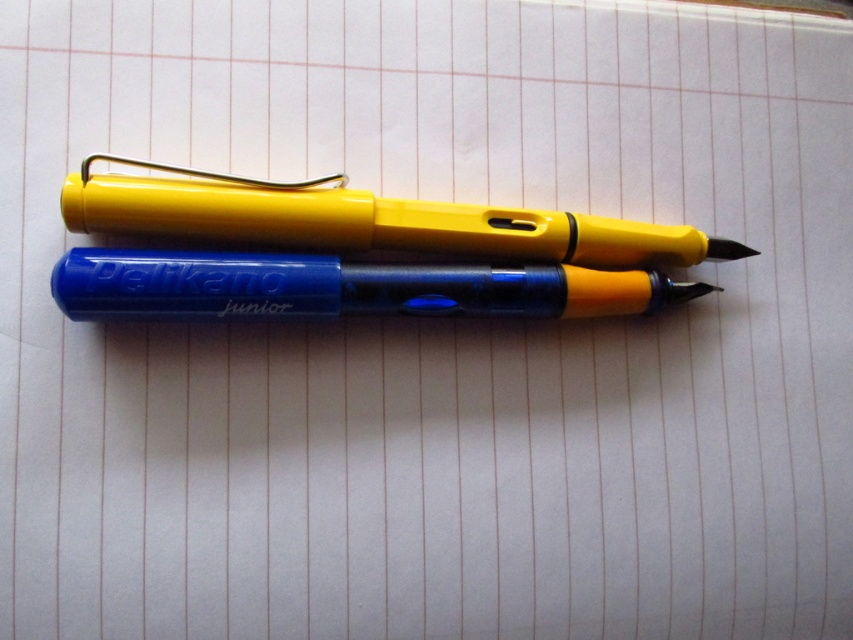
Question: Which object is the farthest from the blue translucent pen at center?

Choices:
 (A) yellow plastic pen at center
 (B) blue plastic pen at center

Answer: (B)

Question: Which of the following is the closest to the observer?

Choices:
 (A) (291, 305)
 (B) (387, 244)
 (C) (67, 284)

Answer: (C)

Question: Which point is farther from the camera taking this photo?

Choices:
 (A) (112, 278)
 (B) (335, 240)

Answer: (B)

Question: Can you confirm if yellow plastic pen at center is smaller than blue translucent pen at center?

Choices:
 (A) yes
 (B) no

Answer: (B)

Question: Is blue translucent pen at center thinner than blue plastic pen at center?

Choices:
 (A) no
 (B) yes

Answer: (A)

Question: Is blue translucent pen at center below blue plastic pen at center?

Choices:
 (A) no
 (B) yes

Answer: (A)